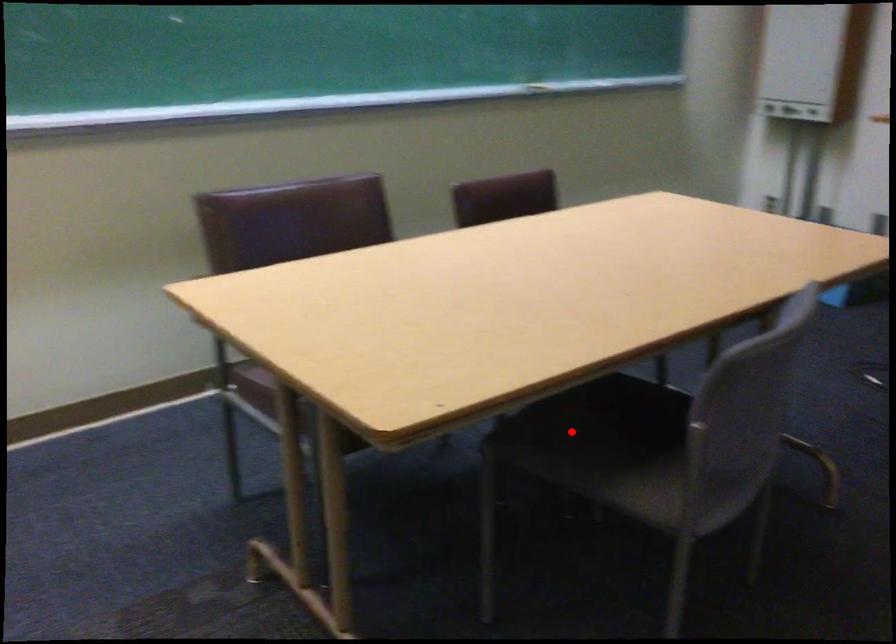
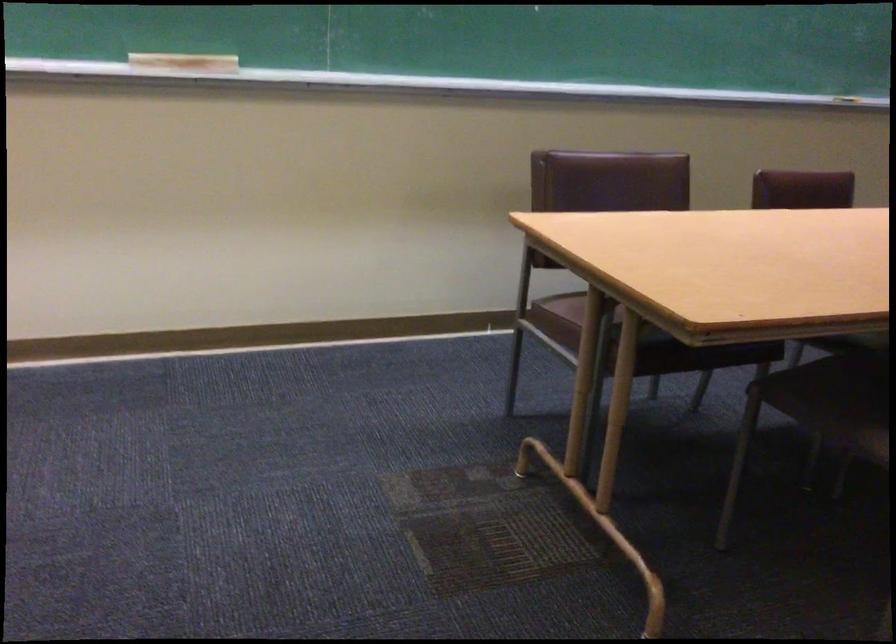
Question: I am providing you with two images of the same scene from different viewpoints. In image1, a red point is highlighted. Considering the same 3D point in image2, which of the following is correct?

Choices:
 (A) It is closer
 (B) It is farther

Answer: (B)